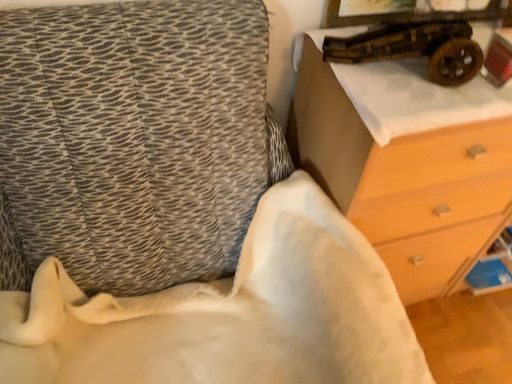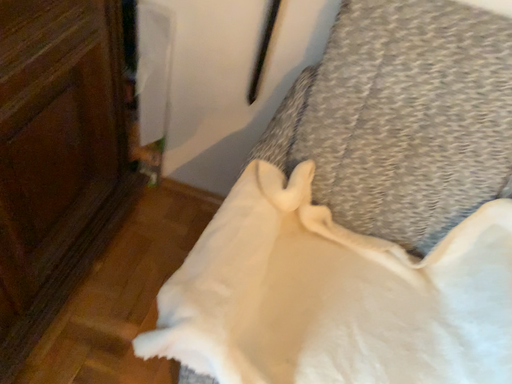
Question: Which way did the camera rotate in the video?

Choices:
 (A) rotated upward
 (B) rotated downward

Answer: (A)